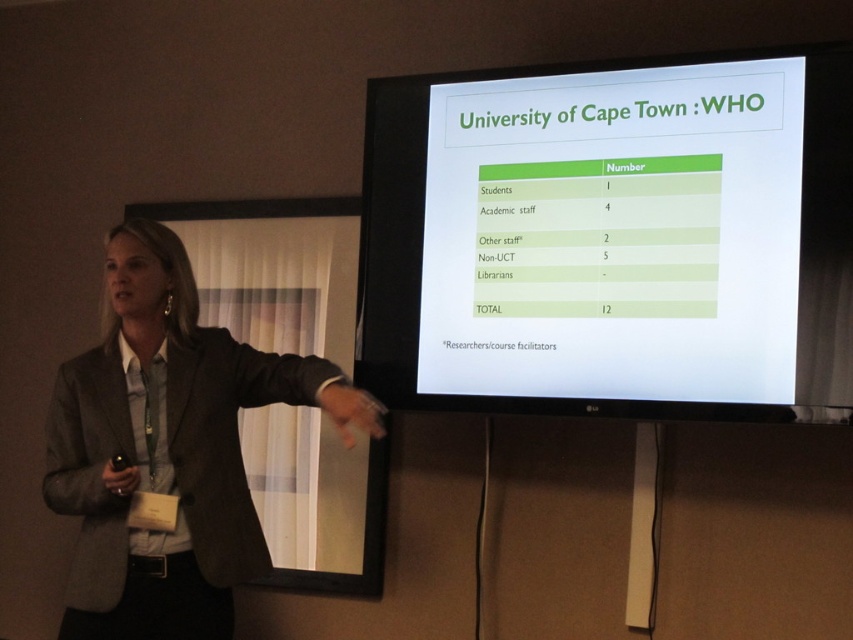
Question: Is green matte projection screen at upper center positioned behind gray fabric jacket at left?

Choices:
 (A) yes
 (B) no

Answer: (A)

Question: Where is green matte projection screen at upper center located in relation to gray fabric jacket at left in the image?

Choices:
 (A) above
 (B) below

Answer: (A)

Question: Which object appears closest to the camera in this image?

Choices:
 (A) gray fabric jacket at left
 (B) green matte projection screen at upper center

Answer: (A)

Question: Which of the following is the closest to the observer?

Choices:
 (A) gray fabric jacket at left
 (B) green matte projection screen at upper center

Answer: (A)

Question: Is green matte projection screen at upper center behind gray fabric jacket at left?

Choices:
 (A) no
 (B) yes

Answer: (B)